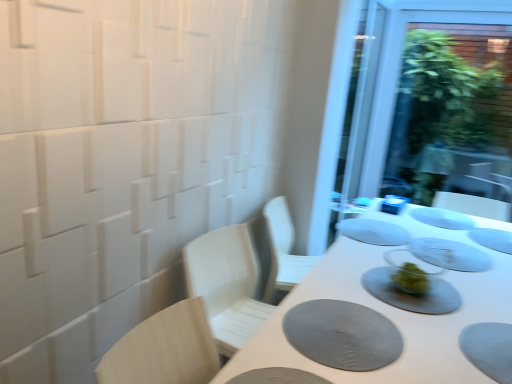
Image resolution: width=512 pixels, height=384 pixels. In order to click on blank area beneath clear glass plate at center, which is the 2th tableware from front to back (from a real-world perspective) in this screenshot , I will do `click(442, 249)`.